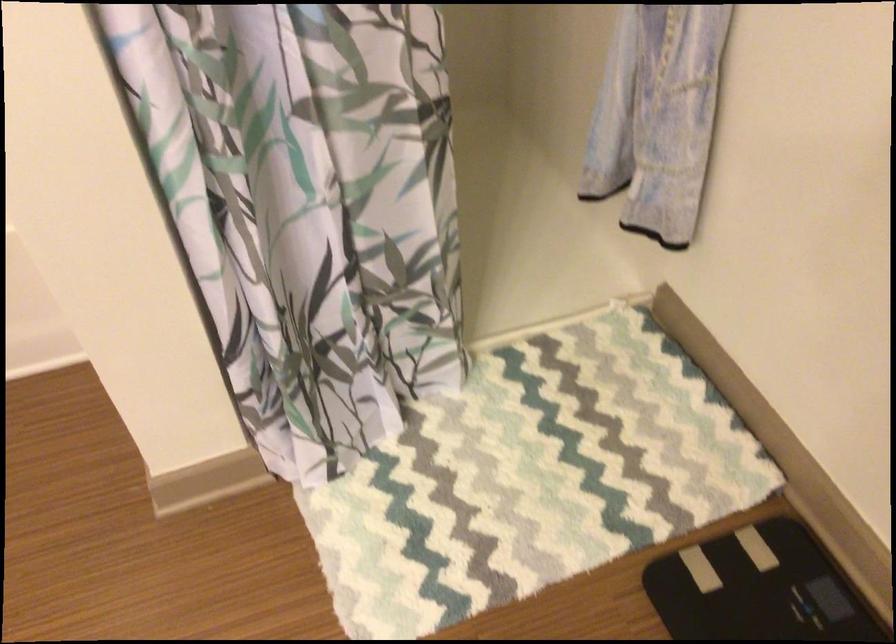
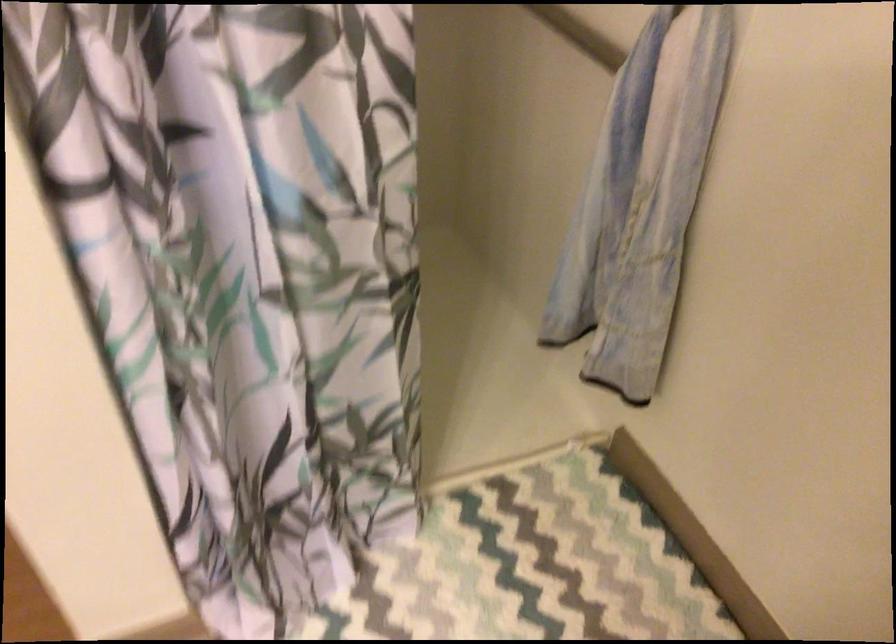
Which direction would the cameraman need to move to produce the second image?

The cameraman walked toward left, forward.